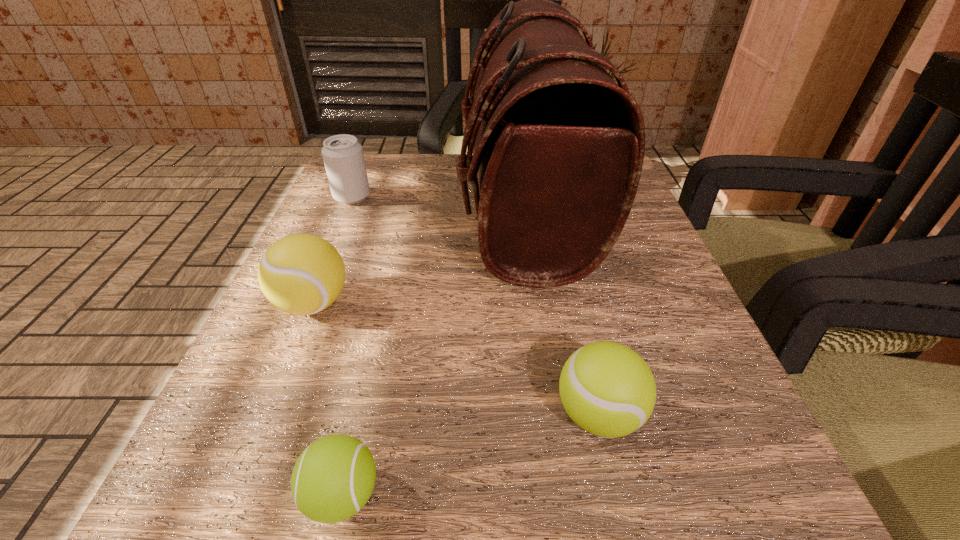
Find the location of a particular element. The height and width of the screenshot is (540, 960). object present at the far left corner is located at coordinates (343, 157).

I want to click on object situated at the near left corner, so click(333, 478).

Find the location of a particular element. The image size is (960, 540). object located in the far right corner section of the desktop is located at coordinates (558, 146).

The image size is (960, 540). In the image, there is a desktop. In order to click on free space at the far edge in this screenshot , I will do `click(473, 193)`.

This screenshot has width=960, height=540. In the image, there is a desktop. In order to click on vacant area at the left edge in this screenshot , I will do `click(377, 245)`.

Identify the location of free space at the right edge. (676, 417).

This screenshot has width=960, height=540. I want to click on vacant space at the far left corner of the desktop, so click(x=403, y=156).

Where is `free space at the near left corner of the desktop`? This screenshot has width=960, height=540. free space at the near left corner of the desktop is located at coordinates 205,495.

Where is `vacant region at the near right corner`? This screenshot has width=960, height=540. vacant region at the near right corner is located at coordinates click(x=750, y=530).

The image size is (960, 540). Find the location of `blank region between the second nearest tennis ball and the can`. blank region between the second nearest tennis ball and the can is located at coordinates (475, 306).